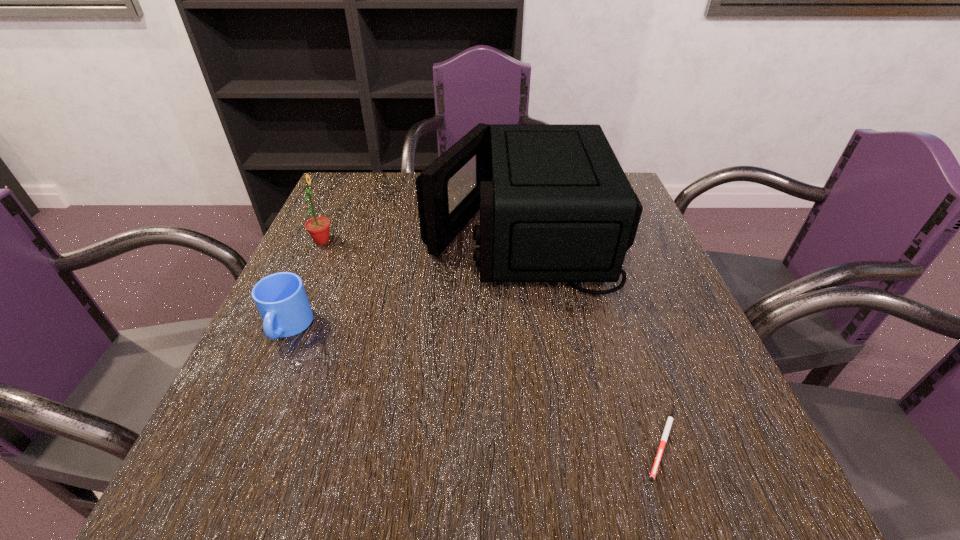
Image resolution: width=960 pixels, height=540 pixels. I want to click on free spot at the left edge of the desktop, so click(x=254, y=393).

Locate an element on the screen. The height and width of the screenshot is (540, 960). free space at the right edge of the desktop is located at coordinates (717, 419).

In the image, there is a desktop. At what (x,y) coordinates should I click in order to perform the action: click on vacant space at the far left corner. Please return your answer as a coordinate pair (x, y). The height and width of the screenshot is (540, 960). Looking at the image, I should click on (372, 217).

Image resolution: width=960 pixels, height=540 pixels. In the image, there is a desktop. Identify the location of blank space at the near left corner. (238, 464).

At what (x,y) coordinates should I click in order to perform the action: click on blank region between the nearest object and the sunflower. Please return your answer as a coordinate pair (x, y). This screenshot has height=540, width=960. Looking at the image, I should click on (492, 342).

The image size is (960, 540). I want to click on empty location between the sunflower and the nearest object, so click(x=492, y=342).

You are a GUI agent. You are given a task and a screenshot of the screen. Output one action in this format:
    pyautogui.click(x=<x>, y=<y>)
    Task: Click on the vacant area between the sunflower and the second shortest object
    This screenshot has height=540, width=960.
    Given the screenshot: What is the action you would take?
    pyautogui.click(x=305, y=284)

Where is `vacant region between the pen and the tallest object`? The width and height of the screenshot is (960, 540). vacant region between the pen and the tallest object is located at coordinates (591, 339).

Locate an element on the screen. The image size is (960, 540). vacant area between the second tallest object and the pen is located at coordinates (492, 342).

Locate an element on the screen. free space between the shortest object and the mug is located at coordinates (475, 386).